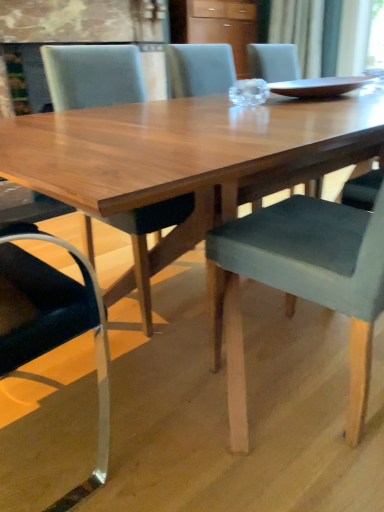
Question: Should I look upward or downward to see velvet grey chair at center, positioned as the second chair in left-to-right order?

Choices:
 (A) up
 (B) down

Answer: (A)

Question: Is matte brown tray at center taller than matte gray chair at center, the first chair when ordered from left to right?

Choices:
 (A) yes
 (B) no

Answer: (B)

Question: Is the depth of matte brown tray at center less than that of matte gray chair at center, which is the 2th chair from right to left?

Choices:
 (A) no
 (B) yes

Answer: (A)

Question: Considering the relative sizes of matte brown tray at center and matte gray chair at center, the first chair when ordered from left to right, in the image provided, is matte brown tray at center wider than matte gray chair at center, the first chair when ordered from left to right,?

Choices:
 (A) no
 (B) yes

Answer: (A)

Question: Is matte brown tray at center to the right of matte gray chair at center, the first chair when ordered from left to right, from the viewer's perspective?

Choices:
 (A) no
 (B) yes

Answer: (B)

Question: From the image's perspective, is matte brown tray at center located above matte gray chair at center, which is the 2th chair from right to left?

Choices:
 (A) no
 (B) yes

Answer: (B)

Question: Is there a large distance between matte brown tray at center and matte gray chair at center, which is the 2th chair from right to left?

Choices:
 (A) yes
 (B) no

Answer: (B)

Question: From a real-world perspective, is velvet grey chair at center, positioned as the second chair in left-to-right order, on top of matte brown tray at center?

Choices:
 (A) no
 (B) yes

Answer: (A)

Question: Is velvet grey chair at center, positioned as the second chair in left-to-right order, at the left side of matte brown tray at center?

Choices:
 (A) no
 (B) yes

Answer: (B)

Question: Is velvet grey chair at center, positioned as the second chair in left-to-right order, at the right side of matte brown tray at center?

Choices:
 (A) no
 (B) yes

Answer: (A)

Question: Does velvet grey chair at center, the first chair when ordered from right to left, have a larger size compared to matte brown tray at center?

Choices:
 (A) no
 (B) yes

Answer: (B)

Question: From the image's perspective, would you say velvet grey chair at center, the first chair when ordered from right to left, is positioned over matte brown tray at center?

Choices:
 (A) yes
 (B) no

Answer: (B)

Question: Is velvet grey chair at center, positioned as the second chair in left-to-right order, oriented towards matte brown tray at center?

Choices:
 (A) yes
 (B) no

Answer: (B)

Question: From a real-world perspective, is matte brown tray at center positioned over wooden cabinet at upper center based on gravity?

Choices:
 (A) no
 (B) yes

Answer: (A)